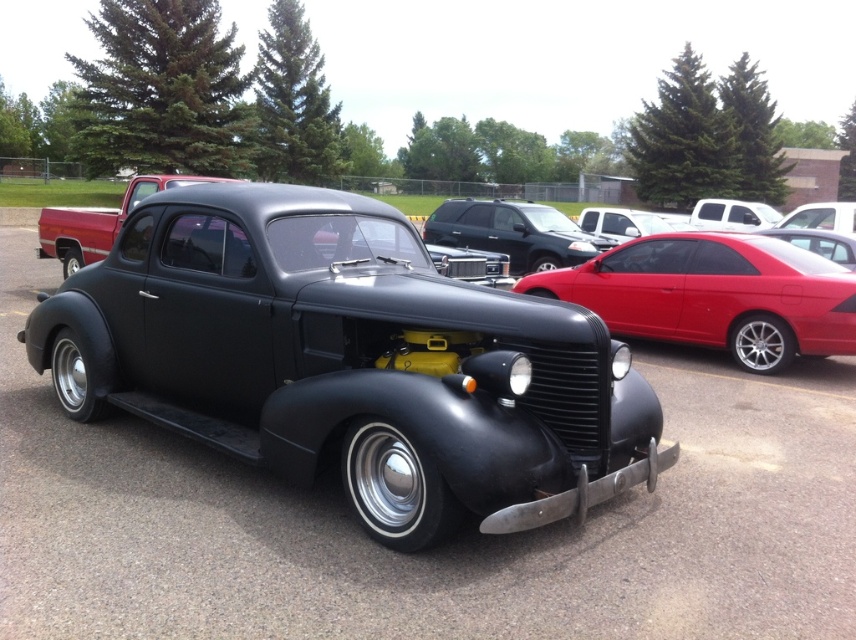
Question: From the image, what is the correct spatial relationship of matte black car at center in relation to matte black suv at center?

Choices:
 (A) above
 (B) below

Answer: (B)

Question: Does matte black car at center have a lesser width compared to matte black suv at center?

Choices:
 (A) no
 (B) yes

Answer: (A)

Question: Which object is closer to the camera taking this photo?

Choices:
 (A) matte black suv at center
 (B) matte black car at center

Answer: (B)

Question: Where is matte black car at center located in relation to matte black suv at center in the image?

Choices:
 (A) right
 (B) left

Answer: (B)

Question: Among these points, which one is farthest from the camera?

Choices:
 (A) (852, 524)
 (B) (521, 230)

Answer: (B)